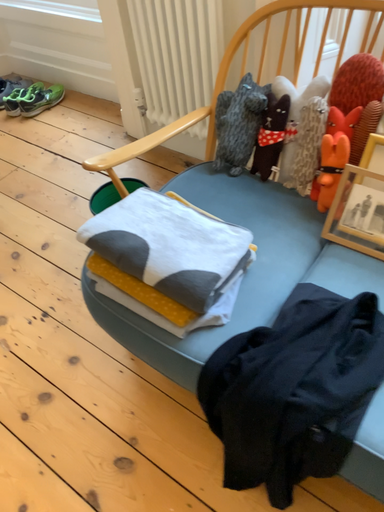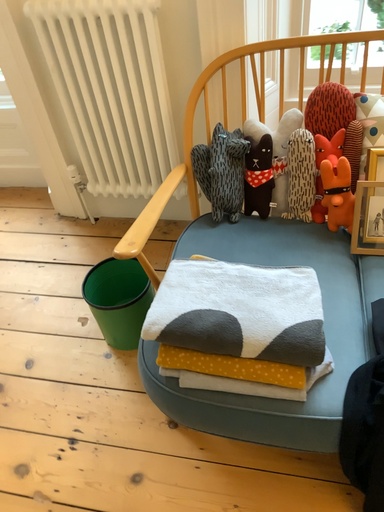
Question: How did the camera likely rotate when shooting the video?

Choices:
 (A) rotated left
 (B) rotated right

Answer: (B)